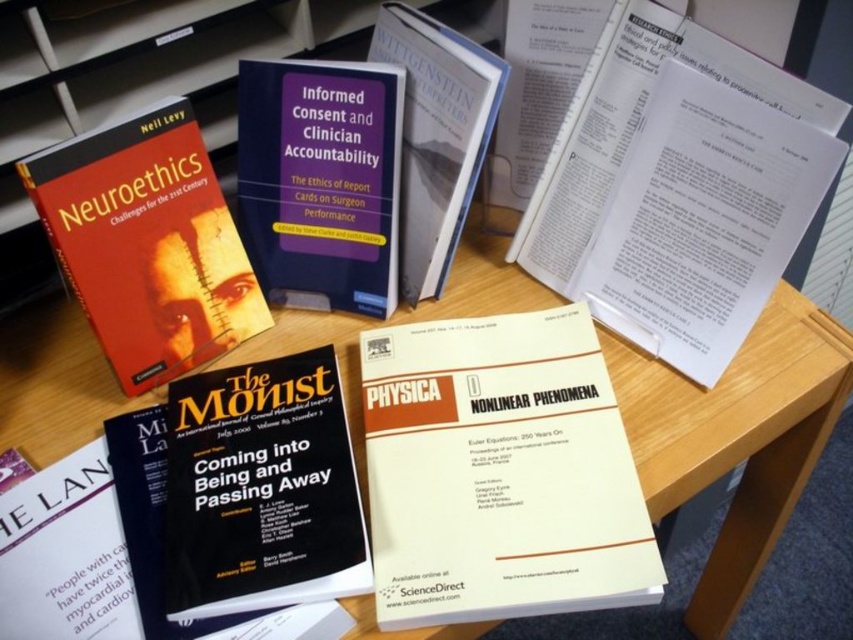
You are a researcher sitting at the desk and need to reach for the white paper document at upper right. Your arm can extend 22 inches. Can you reach it without moving your chair?

The white paper document at upper right is 23.01 inches away from the viewer. Since your arm can only extend 22 inches, you cannot reach it without moving your chair.

You are organizing documents on a desk. You have a white paper document at upper right and a hardcover book at center. Which item is wider?

The white paper document at upper right is wider than the hardcover book at center.